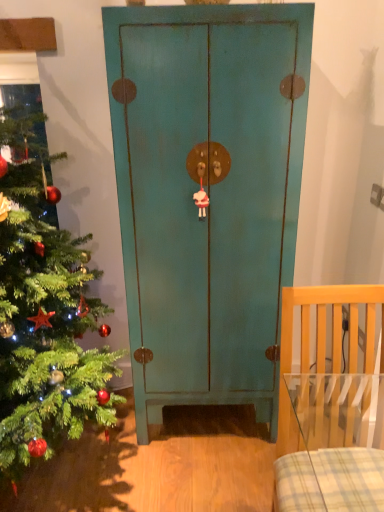
Locate an element on the screen. This screenshot has height=512, width=384. teal matte cabinet at center is located at coordinates (207, 195).

Where is `green matte christmas tree at left`? The image size is (384, 512). green matte christmas tree at left is located at coordinates 43,309.

Which object is further away from the camera taking this photo, teal matte cabinet at center or green matte christmas tree at left?

teal matte cabinet at center is further away from the camera.

Is point (133, 317) in front of point (45, 216)?

Yes, it is.

From a real-world perspective, relative to green matte christmas tree at left, is teal matte cabinet at center vertically above or below?

Clearly, from a real-world perspective, teal matte cabinet at center is below green matte christmas tree at left.

Is teal matte cabinet at center to the right of green matte christmas tree at left from the viewer's perspective?

Yes, teal matte cabinet at center is to the right of green matte christmas tree at left.

Is point (49, 203) behind point (153, 137)?

Yes, point (49, 203) is farther from viewer.

Does green matte christmas tree at left turn towards teal matte cabinet at center?

No, green matte christmas tree at left is not oriented towards teal matte cabinet at center.

Considering the relative sizes of green matte christmas tree at left and teal matte cabinet at center in the image provided, is green matte christmas tree at left thinner than teal matte cabinet at center?

No, green matte christmas tree at left is not thinner than teal matte cabinet at center.

Is light wood chair at right not within teal matte cabinet at center?

Absolutely, light wood chair at right is external to teal matte cabinet at center.

Locate an element on the screen. The image size is (384, 512). door above the light wood chair at right (from the image's perspective) is located at coordinates (207, 195).

From a real-world perspective, is light wood chair at right beneath teal matte cabinet at center?

Correct, in the physical world, light wood chair at right is lower than teal matte cabinet at center.

Is light wood chair at right next to teal matte cabinet at center and touching it?

No, light wood chair at right is not in contact with teal matte cabinet at center.

Is light wood chair at right facing towards green matte christmas tree at left?

No, light wood chair at right is not turned towards green matte christmas tree at left.

Based on the photo, from a real-world perspective, is light wood chair at right above or below green matte christmas tree at left?

In terms of real-world spatial position, light wood chair at right is below green matte christmas tree at left.

Does point (284, 411) come behind point (30, 341)?

Yes, it is behind point (30, 341).

Does point (38, 247) come closer to viewer compared to point (294, 437)?

Yes, point (38, 247) is in front of point (294, 437).

Which is more to the left, green matte christmas tree at left or light wood chair at right?

Positioned to the left is green matte christmas tree at left.

Is light wood chair at right at the back of green matte christmas tree at left?

green matte christmas tree at left is not turned away from light wood chair at right.

Would you consider green matte christmas tree at left to be distant from light wood chair at right?

No.

Which point is more forward, (152, 306) or (341, 473)?

Positioned in front is point (341, 473).

Which object is thinner, teal matte cabinet at center or light wood chair at right?

With smaller width is teal matte cabinet at center.

Which of these two, teal matte cabinet at center or light wood chair at right, stands taller?

teal matte cabinet at center.

Could light wood chair at right be considered to be inside teal matte cabinet at center?

Definitely not — light wood chair at right is not inside teal matte cabinet at center.

Identify the location of christmas tree that appears in front of the teal matte cabinet at center. (43, 309).

Where is `christmas tree that is above the teal matte cabinet at center (from a real-world perspective)`? This screenshot has height=512, width=384. christmas tree that is above the teal matte cabinet at center (from a real-world perspective) is located at coordinates (43, 309).

From the image, which object appears to be nearer to light wood chair at right, teal matte cabinet at center or green matte christmas tree at left?

A: teal matte cabinet at center is positioned closer to the anchor light wood chair at right.

Considering their positions, is teal matte cabinet at center positioned closer to green matte christmas tree at left than light wood chair at right?

teal matte cabinet at center.

Looking at the image, which one is located further to light wood chair at right, green matte christmas tree at left or teal matte cabinet at center?

green matte christmas tree at left is positioned further to the anchor light wood chair at right.

Estimate the real-world distances between objects in this image. Which object is further from teal matte cabinet at center, green matte christmas tree at left or light wood chair at right?

The object further to teal matte cabinet at center is light wood chair at right.

Estimate the real-world distances between objects in this image. Which object is closer to teal matte cabinet at center, light wood chair at right or green matte christmas tree at left?

green matte christmas tree at left lies closer to teal matte cabinet at center than the other object.

Looking at the image, which one is located further to green matte christmas tree at left, light wood chair at right or teal matte cabinet at center?

Among the two, light wood chair at right is located further to green matte christmas tree at left.

Where is `door between green matte christmas tree at left and light wood chair at right from left to right`? door between green matte christmas tree at left and light wood chair at right from left to right is located at coordinates (207, 195).